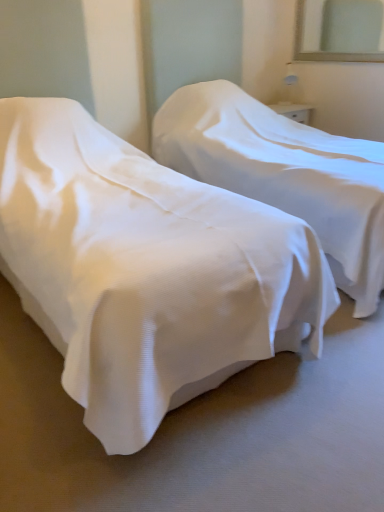
Question: From their relative heights in the image, would you say white fabric bed at center, the second bed viewed from the right, is taller or shorter than white fabric bed at center, marked as the 1th bed in a right-to-left arrangement?

Choices:
 (A) tall
 (B) short

Answer: (B)

Question: Visually, is white fabric bed at center, the second bed viewed from the right, positioned to the left or to the right of white fabric bed at center, marked as the 1th bed in a right-to-left arrangement?

Choices:
 (A) left
 (B) right

Answer: (A)

Question: Which object is the closest to the clear glass mirror at upper right?

Choices:
 (A) white fabric bed at center, which is the first bed in left-to-right order
 (B) white fabric bed at center, marked as the 1th bed in a right-to-left arrangement

Answer: (B)

Question: Estimate the real-world distances between objects in this image. Which object is closer to the white fabric bed at center, which is the first bed in left-to-right order?

Choices:
 (A) clear glass mirror at upper right
 (B) white fabric bed at center, acting as the 2th bed starting from the left

Answer: (B)